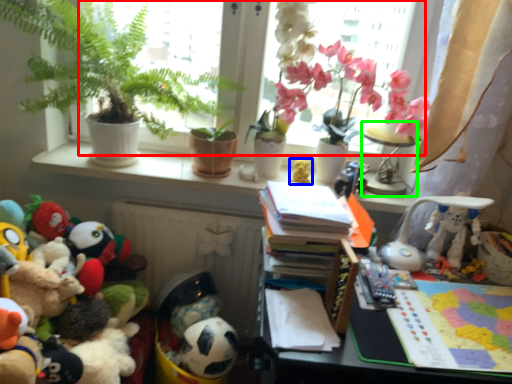
Question: Considering the real-world distances, which object is farthest from window screen (highlighted by a red box)? toy (highlighted by a blue box) or lamp (highlighted by a green box)?

Choices:
 (A) toy
 (B) lamp

Answer: (B)